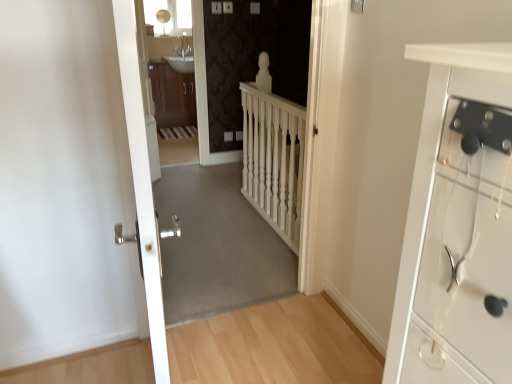
This screenshot has width=512, height=384. I want to click on vacant area located to the right-hand side of white metallic door at center, so click(x=273, y=355).